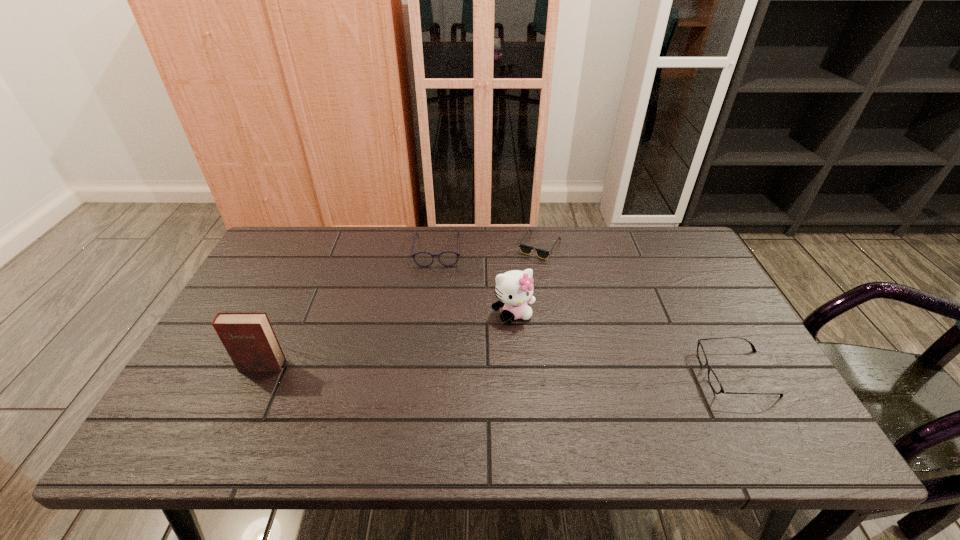
At what (x,y) coordinates should I click in order to perform the action: click on vacant space at the far left corner. Please return your answer as a coordinate pair (x, y). Looking at the image, I should click on (270, 264).

This screenshot has height=540, width=960. I want to click on free space at the far right corner, so click(x=653, y=271).

Locate an element on the screen. Image resolution: width=960 pixels, height=540 pixels. vacant region at the near right corner is located at coordinates (743, 403).

I want to click on free point between the diary and the shorter spectacles, so pyautogui.click(x=499, y=369).

Locate an element on the screen. unoccupied area between the farther spectacles and the sunglasses is located at coordinates click(x=489, y=248).

At what (x,y) coordinates should I click in order to perform the action: click on free space between the diary and the taller spectacles. Please return your answer as a coordinate pair (x, y). Looking at the image, I should click on (350, 308).

Where is `vacant region between the rightmost object and the diary`? The width and height of the screenshot is (960, 540). vacant region between the rightmost object and the diary is located at coordinates (499, 369).

The height and width of the screenshot is (540, 960). Find the location of `vacant area between the third farthest object and the left spectacles`. vacant area between the third farthest object and the left spectacles is located at coordinates (475, 282).

The image size is (960, 540). What are the coordinates of `free space between the right spectacles and the shortest object` in the screenshot? It's located at (637, 310).

Image resolution: width=960 pixels, height=540 pixels. In order to click on vacant space that is in between the leftmost object and the shortest object in this screenshot , I will do `click(400, 306)`.